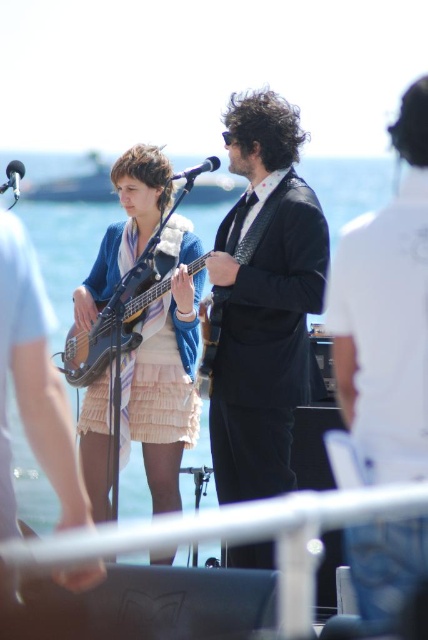
You are standing at the center of the stage where the two musicians are performing. There are two points marked on the stage floor. One is at coordinates point (288, 256) and the other at point (103, 451). If you want to place a microphone stand closer to the audience, which point should you choose?

Point (103, 451) is farther from the viewer, meaning it is closer to the audience. Therefore, placing the microphone stand at point (103, 451) would position it nearer to the audience.